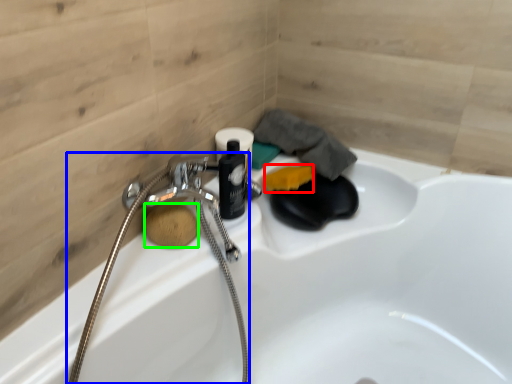
Question: Considering the real-world distances, which object is closest to soap (highlighted by a red box)? garden hose (highlighted by a blue box) or soap (highlighted by a green box).

Choices:
 (A) garden hose
 (B) soap

Answer: (A)